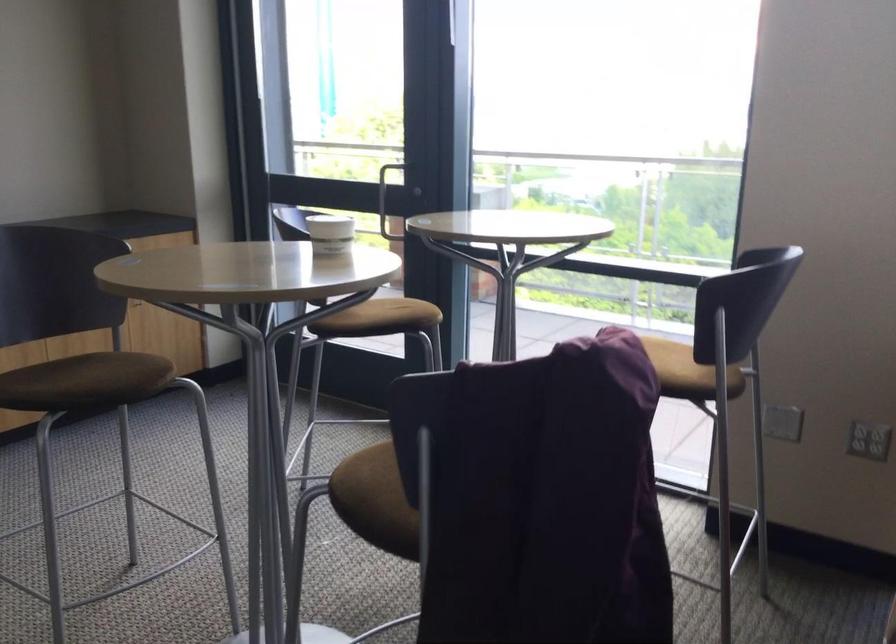
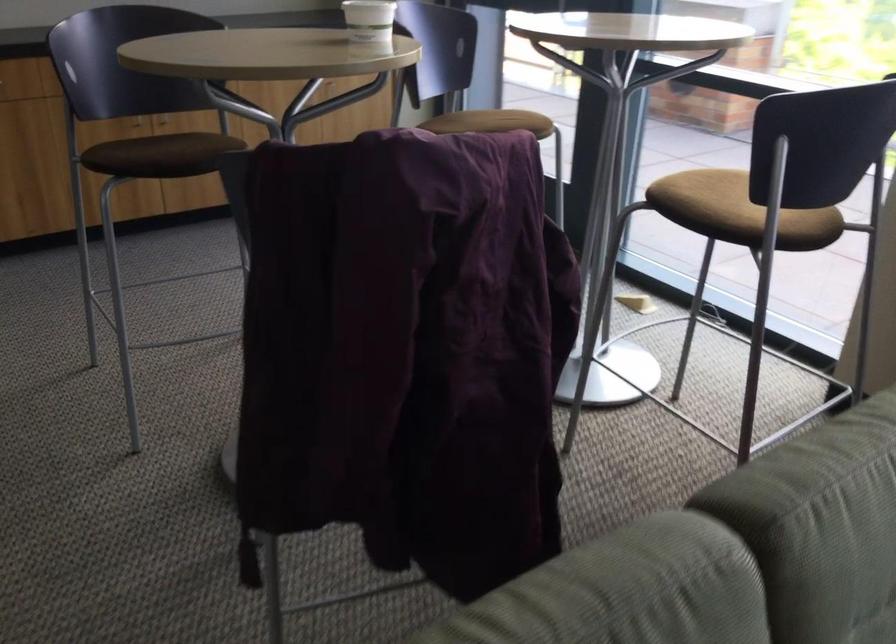
Question: Based on the continuous images, in which direction is the camera rotating? Reply with the corresponding letter.

Choices:
 (A) Left
 (B) Right
 (C) Up
 (D) Down

Answer: (A)